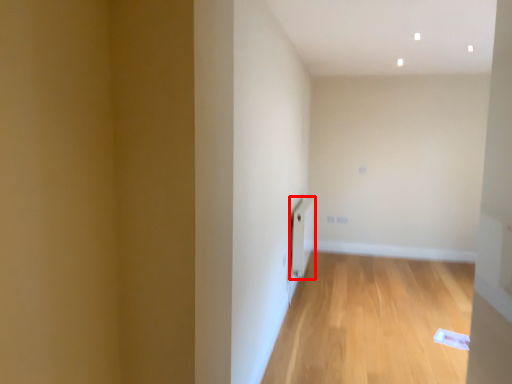
Question: In this image, where is radiator (annotated by the red box) located relative to corridor?

Choices:
 (A) right
 (B) left

Answer: (B)